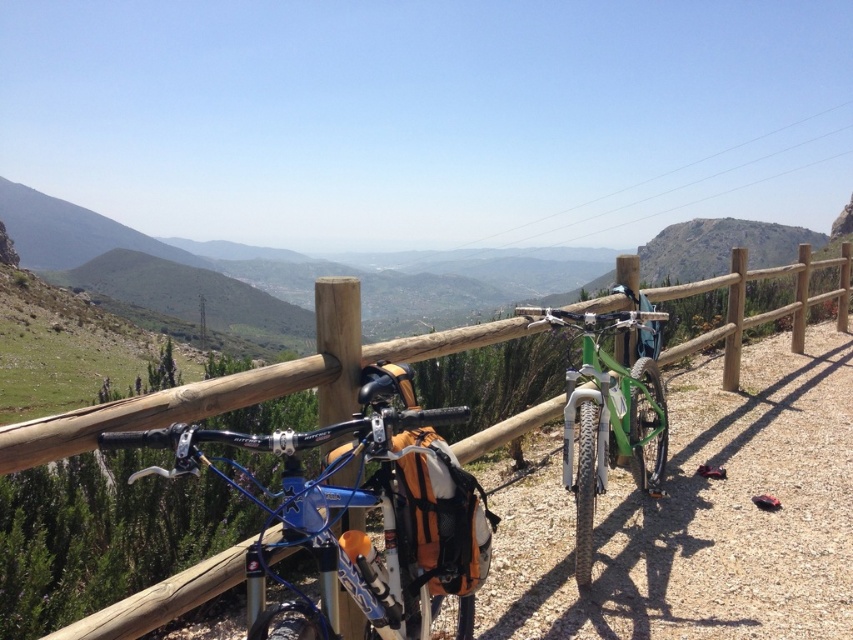
Which is in front, point (796, 524) or point (347, 584)?

Point (347, 584) is in front.

Can you confirm if green matte bicycle at center is positioned to the left of blue metallic bicycle at center?

In fact, green matte bicycle at center is to the right of blue metallic bicycle at center.

Does point (793, 515) come in front of point (287, 586)?

No, (793, 515) is further to viewer.

The width and height of the screenshot is (853, 640). What are the coordinates of `green matte bicycle at center` in the screenshot? It's located at click(x=701, y=516).

Between point (360, 490) and point (146, 618), which one is positioned behind?

The point (146, 618) is more distant.

Is point (335, 497) farther from camera compared to point (86, 632)?

No, (335, 497) is closer to viewer.

Is point (357, 579) in front of point (426, 340)?

That is True.

Locate an element on the screen. The height and width of the screenshot is (640, 853). blue metallic bicycle at center is located at coordinates (357, 508).

Identify the location of green matte bicycle at center. (701, 516).

Which is below, green matte bicycle at center or green matte mountain bike at center?

green matte bicycle at center

Which is in front, point (619, 483) or point (605, 324)?

Point (605, 324) is in front.

Where is `green matte bicycle at center`? Image resolution: width=853 pixels, height=640 pixels. green matte bicycle at center is located at coordinates 701,516.